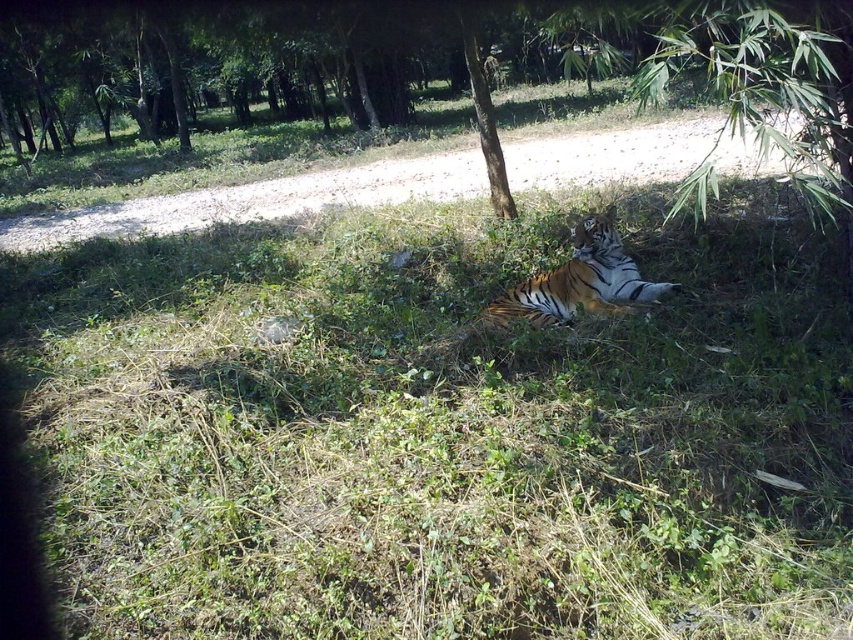
Question: Which object is closer to the camera taking this photo?

Choices:
 (A) orange-yellow fur tiger at center
 (B) green textured tree at upper center

Answer: (A)

Question: Is orange-yellow fur tiger at center further to the viewer compared to green textured tree at upper center?

Choices:
 (A) yes
 (B) no

Answer: (B)

Question: Does orange-yellow fur tiger at center have a lesser width compared to green textured tree at upper center?

Choices:
 (A) yes
 (B) no

Answer: (B)

Question: Among these objects, which one is farthest from the camera?

Choices:
 (A) orange-yellow fur tiger at center
 (B) green textured tree at upper center

Answer: (B)

Question: Does orange-yellow fur tiger at center appear on the right side of green textured tree at upper center?

Choices:
 (A) no
 (B) yes

Answer: (B)